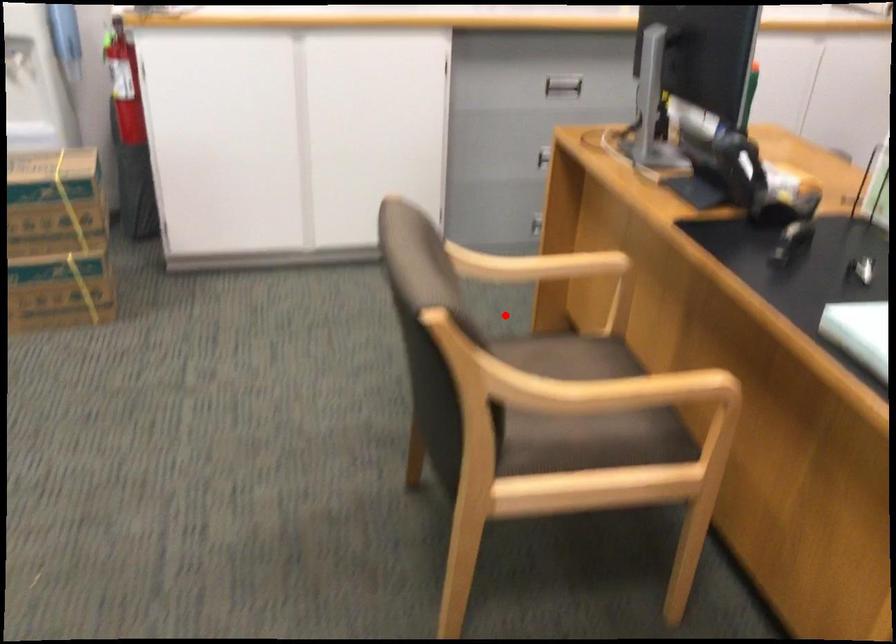
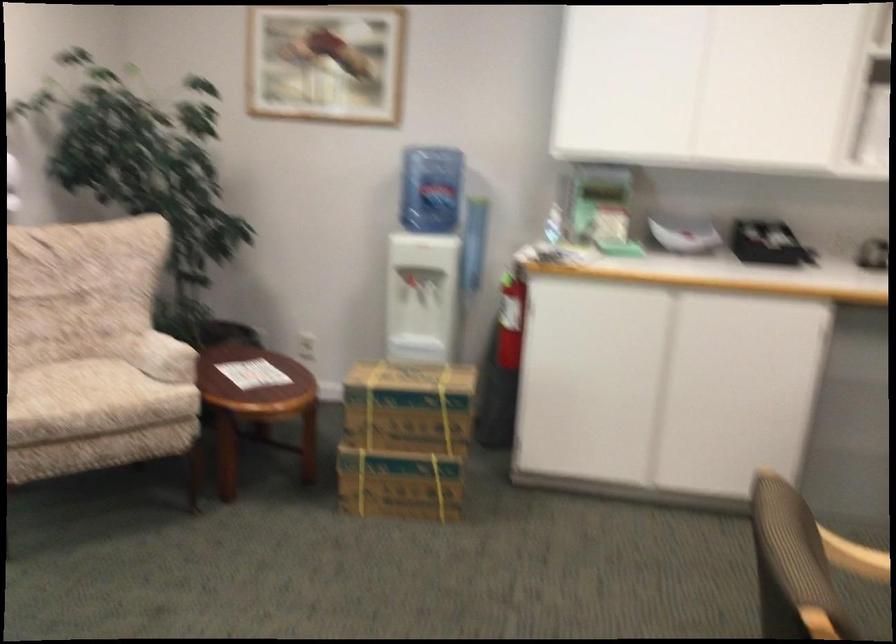
In the second image, find the point that corresponds to the highlighted location in the first image.

(866, 607)